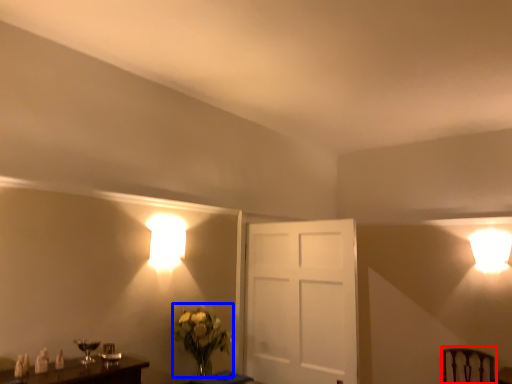
Question: Which of the following is the farthest to the observer, swivel chair (highlighted by a red box) or floral arrangement (highlighted by a blue box)?

Choices:
 (A) swivel chair
 (B) floral arrangement

Answer: (A)